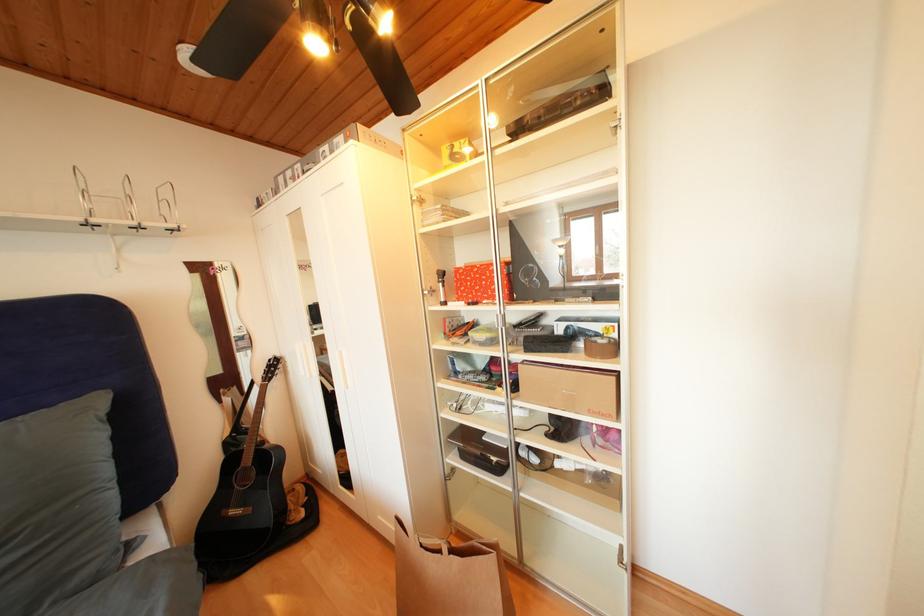
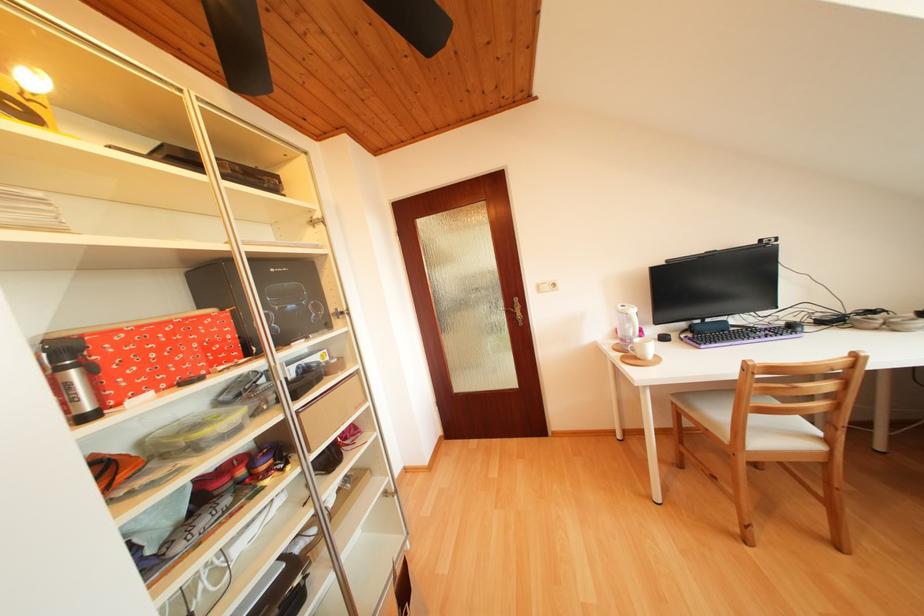
Locate, in the second image, the point that corresponds to point (475, 286) in the first image.

(151, 358)